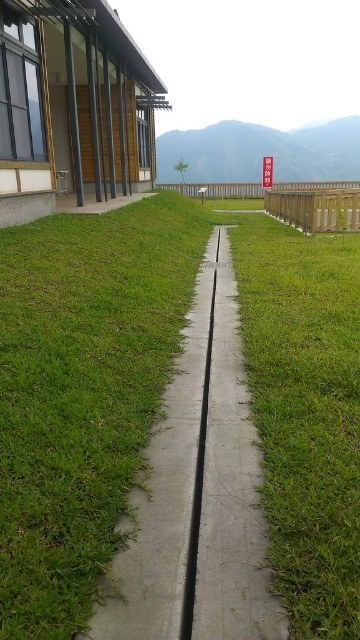
From the picture: Can you confirm if concrete at center is positioned to the left of wooden fence at right?

Yes, concrete at center is to the left of wooden fence at right.

Does concrete at center have a larger size compared to wooden fence at right?

Incorrect, concrete at center is not larger than wooden fence at right.

This screenshot has height=640, width=360. Identify the location of concrete at center. (199, 493).

In order to click on concrete at center in this screenshot , I will do `click(199, 493)`.